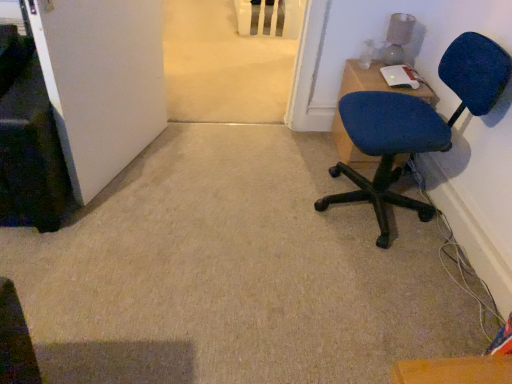
Question: In terms of size, does blue fabric chair at upper right appear bigger or smaller than blue fabric chair at right?

Choices:
 (A) big
 (B) small

Answer: (B)

Question: Is blue fabric chair at upper right situated inside blue fabric chair at right or outside?

Choices:
 (A) inside
 (B) outside

Answer: (B)

Question: Estimate the real-world distances between objects in this image. Which object is closer to the blue fabric chair at right?

Choices:
 (A) white matte door at lower left
 (B) blue fabric chair at upper right

Answer: (B)

Question: Estimate the real-world distances between objects in this image. Which object is farther from the blue fabric chair at upper right?

Choices:
 (A) blue fabric chair at right
 (B) white matte door at lower left

Answer: (B)